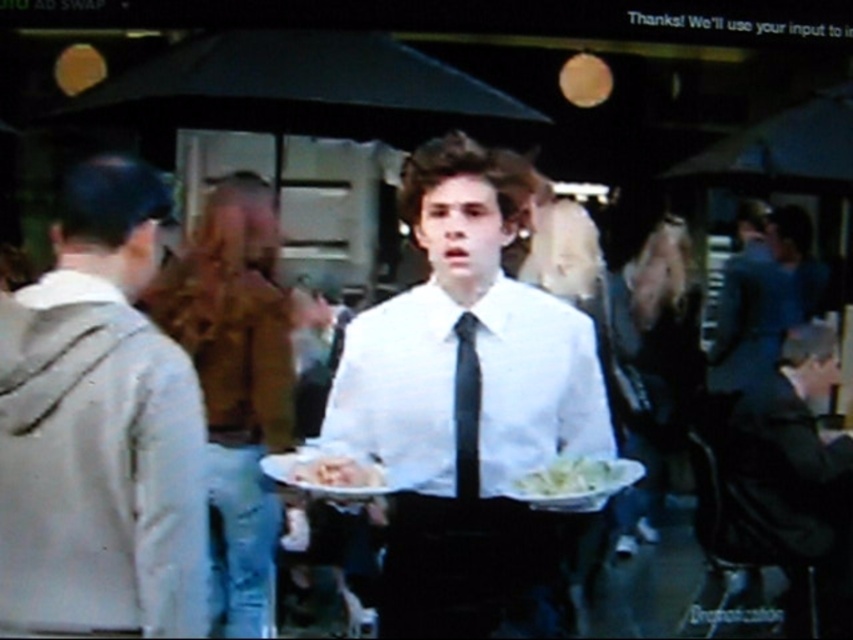
Does white matte shirt at center have a lesser width compared to white paper plate at center?

Incorrect, white matte shirt at center's width is not less than white paper plate at center's.

Consider the image. Who is more distant from viewer, (234,176) or (590,461)?

Positioned behind is point (234,176).

Measure the distance between white matte shirt at center and camera.

The distance of white matte shirt at center from camera is 3.71 meters.

Find the location of a particular element. This screenshot has width=853, height=640. white matte shirt at center is located at coordinates (236, 380).

Can you confirm if light gray hoodie at left is positioned below black silk tie at center?

Incorrect, light gray hoodie at left is not positioned below black silk tie at center.

Who is more forward, (164, 500) or (461, 392)?

Positioned in front is point (164, 500).

This screenshot has height=640, width=853. What are the coordinates of `light gray hoodie at left` in the screenshot? It's located at (99, 429).

Does black glossy tie at center appear on the left side of white paper plate at center?

No, black glossy tie at center is not to the left of white paper plate at center.

Between black glossy tie at center and white paper plate at center, which one is positioned lower?

black glossy tie at center

Identify the location of black glossy tie at center. (791, 472).